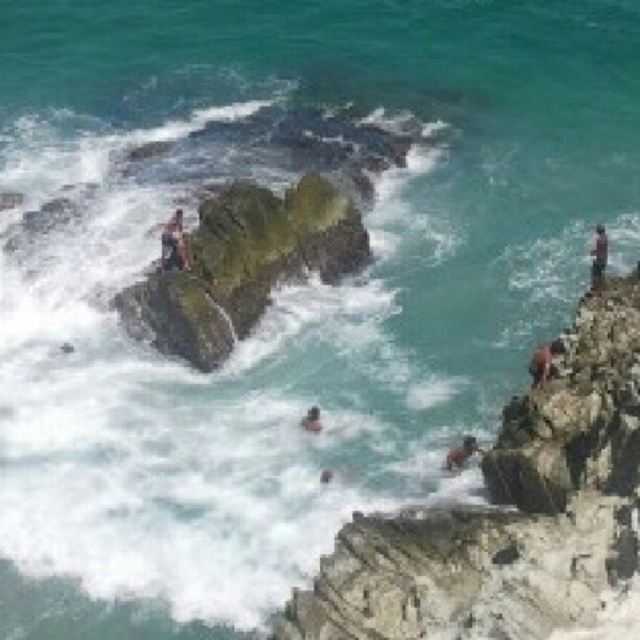
You are a hiker who wants to join the people swimming in the water. From your current position at the edge of the cliff where the brown textured person at right is standing, can you directly see the smooth tan skin at lower center in the water below?

Yes, the brown textured person at right is above the smooth tan skin at lower center, meaning the cliff edge where you are standing offers a direct line of sight downward to the smooth tan skin at lower center in the water below.

You are a photographer trying to capture the scene with both the brown textured person at right and the smooth skin person at center in the same frame. Based on their positions, which person is closer to the right edge of the photo?

The brown textured person at right is positioned to the right of the smooth skin person at center, so the brown textured person at right is closer to the right edge of the photo.

You are a photographer planning to capture a wide shot of the coastal scene. You need to ensure that both the smooth skin person at right and the smooth tan skin at lower center are visible in the frame. Given their sizes, which person will appear larger in the final photograph?

The smooth skin person at right will appear larger in the photograph because their width surpasses that of the smooth tan skin at lower center.